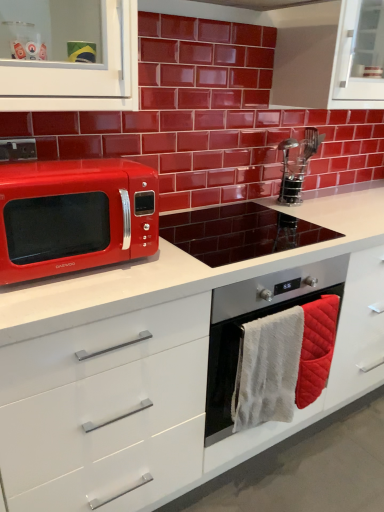
Find the location of a particular element. The height and width of the screenshot is (512, 384). vacant space situated above white glossy countertop at center (from a real-world perspective) is located at coordinates (268, 229).